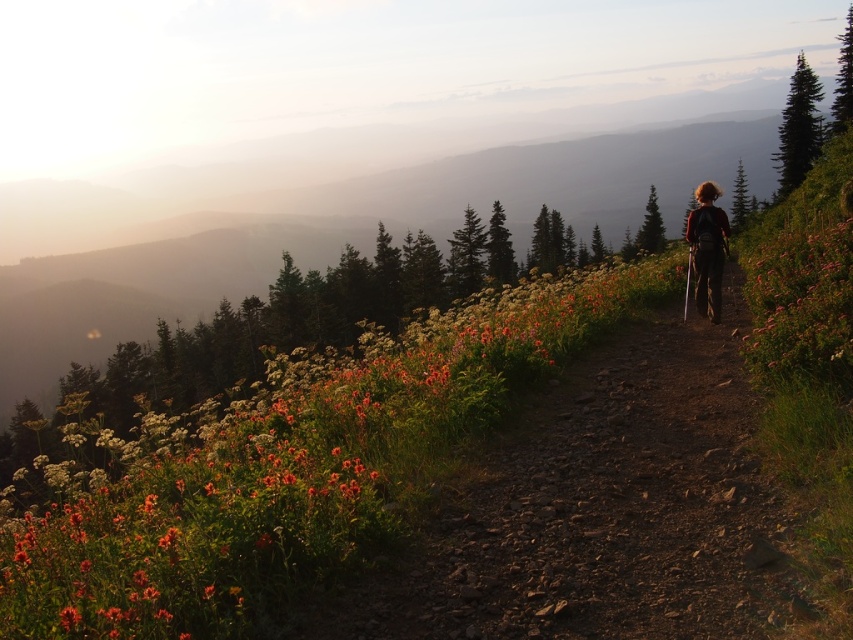
Question: Does dirt path at center have a smaller size compared to orange matte flowers at center?

Choices:
 (A) no
 (B) yes

Answer: (B)

Question: Which object appears closest to the camera in this image?

Choices:
 (A) orange matte flowers at center
 (B) dirt path at center

Answer: (A)

Question: Among these points, which one is farthest from the camera?

Choices:
 (A) (387, 513)
 (B) (718, 348)

Answer: (B)

Question: Is dirt path at center smaller than orange matte flowers at center?

Choices:
 (A) no
 (B) yes

Answer: (B)

Question: Does dirt path at center appear over orange matte flowers at center?

Choices:
 (A) no
 (B) yes

Answer: (A)